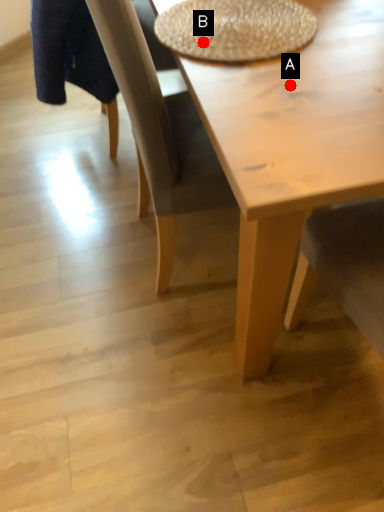
Question: Two points are circled on the image, labeled by A and B beside each circle. Which point is farther from the camera taking this photo?

Choices:
 (A) A is further
 (B) B is further

Answer: (B)